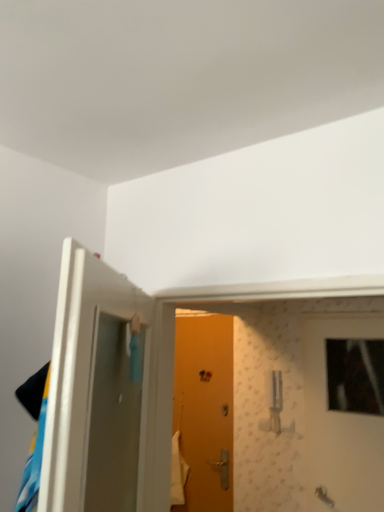
Question: From a real-world perspective, is white glossy door at left, the 3th door in the back-to-front sequence, beneath orange matte door at center, the 1th door from the back?

Choices:
 (A) yes
 (B) no

Answer: (B)

Question: Is white glossy door at left, which is counted as the 1th door, starting from the front, facing away from orange matte door at center, arranged as the 2th door when viewed from the right?

Choices:
 (A) yes
 (B) no

Answer: (B)

Question: Is orange matte door at center, arranged as the 2th door when viewed from the right, completely or partially inside white glossy door at left, the 3th door in the back-to-front sequence?

Choices:
 (A) yes
 (B) no

Answer: (B)

Question: Is white glossy door at left, the 3th door in the back-to-front sequence, further to camera compared to orange matte door at center, the 1th door from the back?

Choices:
 (A) yes
 (B) no

Answer: (B)

Question: Considering the relative positions of white glossy door at left, the 3th door in the back-to-front sequence, and orange matte door at center, arranged as the 2th door when viewed from the right, in the image provided, is white glossy door at left, the 3th door in the back-to-front sequence, to the right of orange matte door at center, arranged as the 2th door when viewed from the right, from the viewer's perspective?

Choices:
 (A) no
 (B) yes

Answer: (A)

Question: From the image's perspective, is white glossy door at left, which is counted as the 1th door, starting from the front, above orange matte door at center, which ranks as the 2th door in left-to-right order?

Choices:
 (A) yes
 (B) no

Answer: (A)

Question: Is orange matte door at center, arranged as the 2th door when viewed from the right, far away from white glossy door at left, arranged as the third door when viewed from the right?

Choices:
 (A) yes
 (B) no

Answer: (A)

Question: Is white glossy door at left, the 3th door in the back-to-front sequence, surrounded by orange matte door at center, the 1th door from the back?

Choices:
 (A) yes
 (B) no

Answer: (B)

Question: Is orange matte door at center, the third door from the front, outside of white glossy door at left, which is counted as the 1th door, starting from the front?

Choices:
 (A) yes
 (B) no

Answer: (A)

Question: Is orange matte door at center, the 1th door from the back, at the left side of white glossy door at left, arranged as the third door when viewed from the right?

Choices:
 (A) yes
 (B) no

Answer: (B)

Question: Does orange matte door at center, the third door from the front, come behind white glossy door at left, arranged as the third door when viewed from the right?

Choices:
 (A) no
 (B) yes

Answer: (B)

Question: Could you tell me if orange matte door at center, the 1th door from the back, is facing white glossy door at left, positioned as the first door in left-to-right order?

Choices:
 (A) no
 (B) yes

Answer: (A)

Question: Could orange matte door at center, which ranks as the 2th door in left-to-right order, be considered to be inside wooden door at center, which ranks as the 2th door in front-to-back order?

Choices:
 (A) yes
 (B) no

Answer: (B)